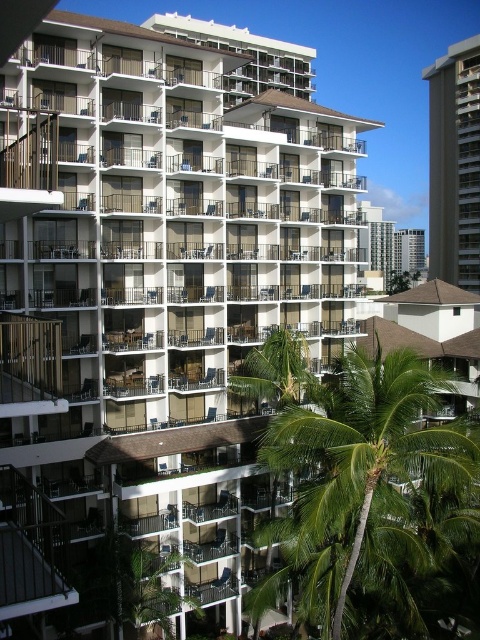
Which of these two, green leafy palm tree at center or white glass condominium at upper right, stands taller?

white glass condominium at upper right

Locate an element on the screen. This screenshot has height=640, width=480. green leafy palm tree at center is located at coordinates (276, 371).

Between green leafy palm tree at lower right and smooth concrete building at right, which one has more height?

smooth concrete building at right is taller.

Can you confirm if green leafy palm tree at lower right is taller than smooth concrete building at right?

No.

The image size is (480, 640). Describe the element at coordinates (360, 483) in the screenshot. I see `green leafy palm tree at lower right` at that location.

In order to click on green leafy palm tree at lower right in this screenshot , I will do `click(360, 483)`.

Does smooth concrete building at right appear over green leafy palm tree at center?

Yes.

Between smooth concrete building at right and green leafy palm tree at center, which one is positioned higher?

Positioned higher is smooth concrete building at right.

You are a GUI agent. You are given a task and a screenshot of the screen. Output one action in this format:
    pyautogui.click(x=<x>, y=<y>)
    Task: Click on the smooth concrete building at right
    
    Given the screenshot: What is the action you would take?
    pyautogui.click(x=455, y=164)